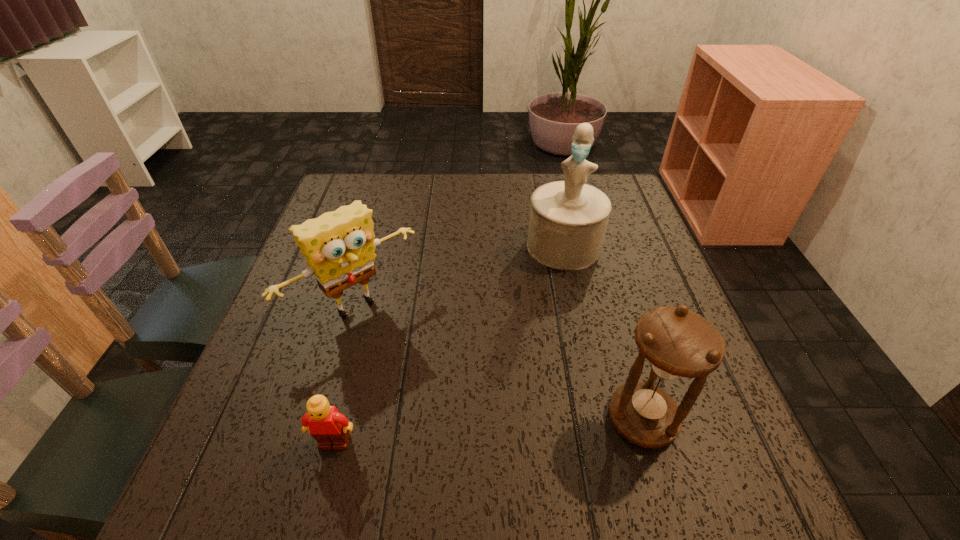
Where is `free region located on the face of the sponge`? This screenshot has height=540, width=960. free region located on the face of the sponge is located at coordinates (402, 352).

The width and height of the screenshot is (960, 540). I want to click on vacant area situated 0.220m on the face of the sponge, so click(454, 410).

This screenshot has height=540, width=960. Find the location of `Lego present at the near edge`. Lego present at the near edge is located at coordinates click(x=326, y=425).

Locate an element on the screen. hourglass that is at the near edge is located at coordinates (677, 343).

Identify the location of Lego that is at the left edge. (326, 425).

Locate an element on the screen. The image size is (960, 540). sponge at the left edge is located at coordinates (339, 246).

Where is `hourglass located at the right edge`? The height and width of the screenshot is (540, 960). hourglass located at the right edge is located at coordinates (677, 343).

Locate an element on the screen. figurine at the right edge is located at coordinates (568, 219).

At what (x,y) coordinates should I click in order to perform the action: click on object present at the near left corner. Please return your answer as a coordinate pair (x, y). Looking at the image, I should click on [x=326, y=425].

Find the location of `object present at the near right corner`. object present at the near right corner is located at coordinates (677, 343).